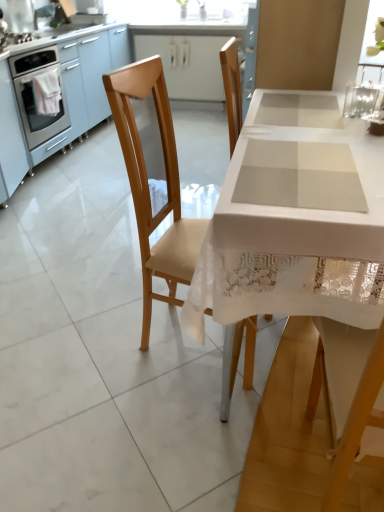
Identify the location of empty space that is to the right of stainless steel oven at left. Image resolution: width=384 pixels, height=512 pixels. tap(92, 165).